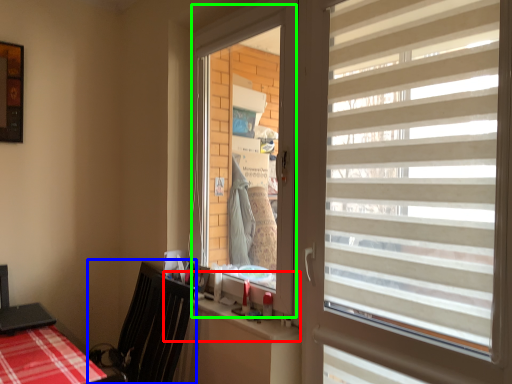
Question: Which object is positioned farthest from counter top (highlighted by a red box)? Select from swivel chair (highlighted by a blue box) and window screen (highlighted by a green box).

Choices:
 (A) swivel chair
 (B) window screen

Answer: (B)